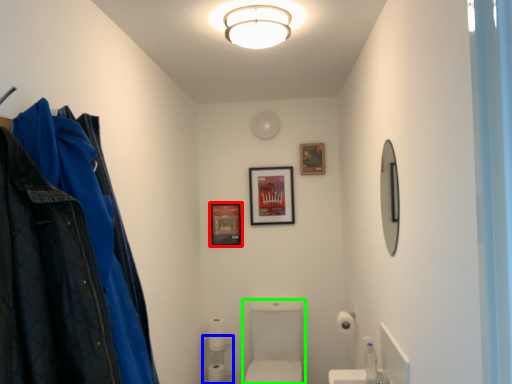
Question: Considering the real-world distances, which object is closest to picture frame (highlighted by a red box)? shelf (highlighted by a blue box) or sink (highlighted by a green box).

Choices:
 (A) shelf
 (B) sink

Answer: (B)